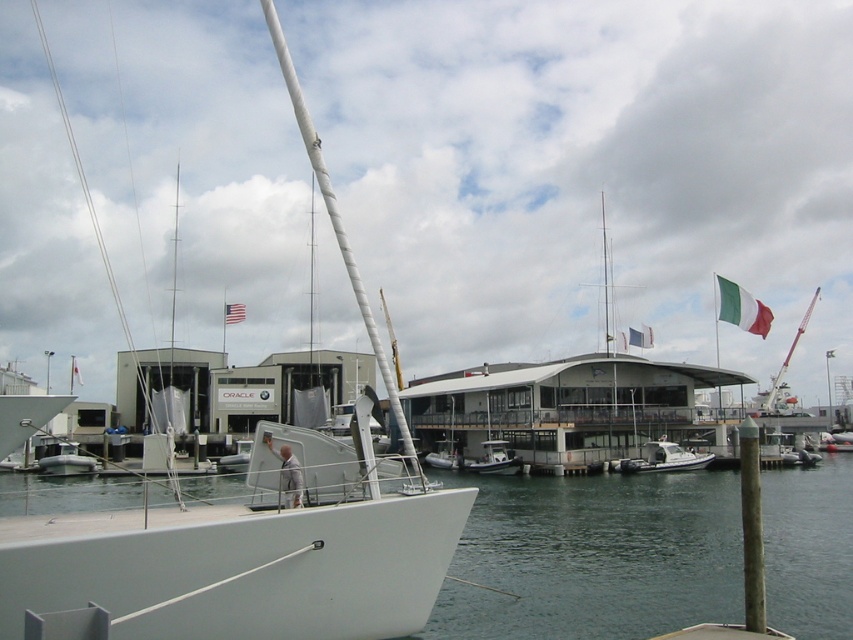
Question: Which point is closer to the camera?

Choices:
 (A) green fabric flag at upper right
 (B) rubber dinghy at lower left
 (C) brown wood post at lower right
 (D) white water at lower left

Answer: (C)

Question: Does green fabric flag at upper right have a lesser width compared to red fabric flag at center?

Choices:
 (A) no
 (B) yes

Answer: (B)

Question: Can you confirm if white water at lower left is bigger than white matte mast at upper center?

Choices:
 (A) yes
 (B) no

Answer: (B)

Question: Considering the real-world distances, which object is farthest from the white matte sailboat at center?

Choices:
 (A) rubber dinghy at lower left
 (B) green-white-red fabric flag at upper right

Answer: (B)

Question: Among these points, which one is nearest to the camera?

Choices:
 (A) pos(759,301)
 (B) pos(651,452)
 (C) pos(741,509)
 (D) pos(640,339)

Answer: (C)

Question: Where is white water at lower left located in relation to white matte mast at upper center in the image?

Choices:
 (A) left
 (B) right

Answer: (B)